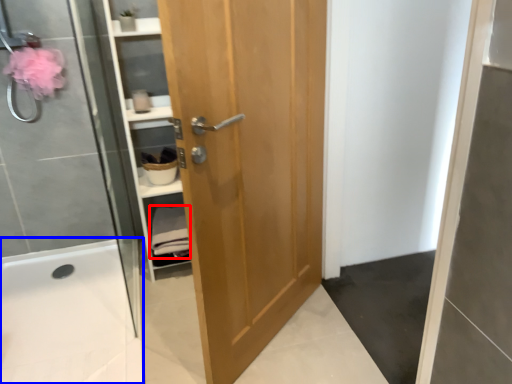
Question: Among these objects, which one is farthest to the camera, material (highlighted by a red box) or bath (highlighted by a blue box)?

Choices:
 (A) material
 (B) bath

Answer: (A)